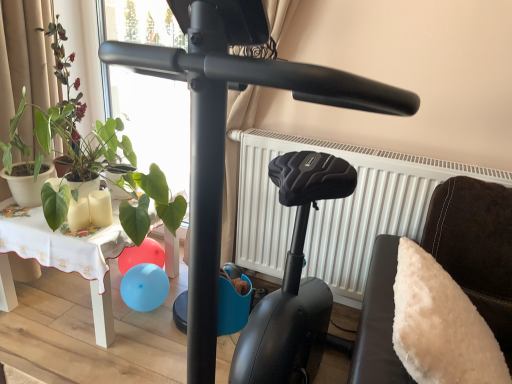
This screenshot has height=384, width=512. Identify the location of vacant space underneath white fabric-covered table at lower left (from a real-world perspective). (69, 306).